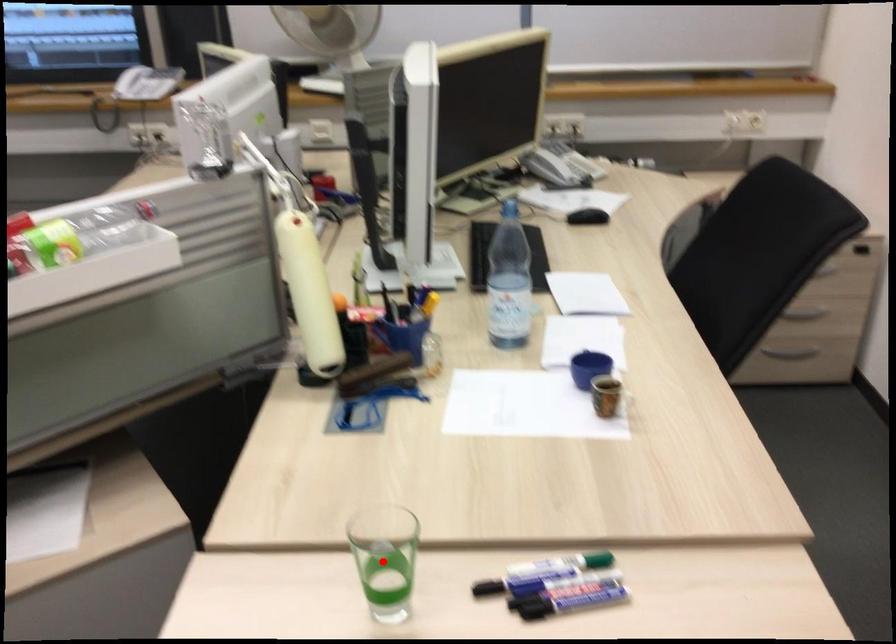
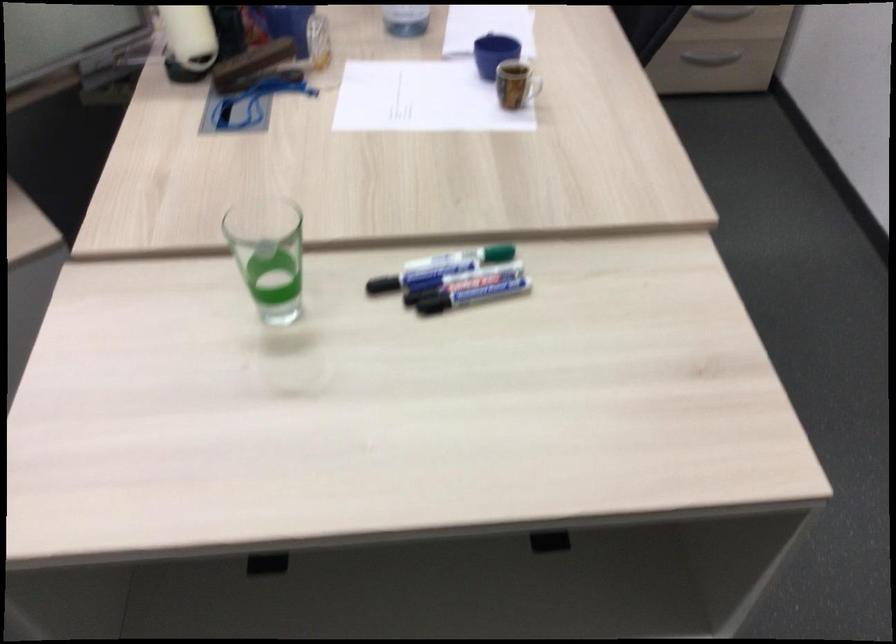
The point at the highlighted location is marked in the first image. Where is the corresponding point in the second image?

(268, 254)